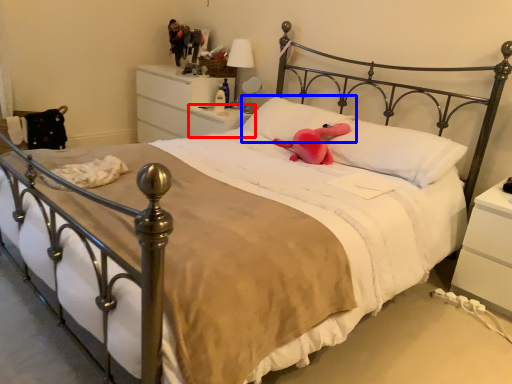
Question: Which object appears farthest to the camera in this image, nightstand (highlighted by a red box) or pillow (highlighted by a blue box)?

Choices:
 (A) nightstand
 (B) pillow

Answer: (A)